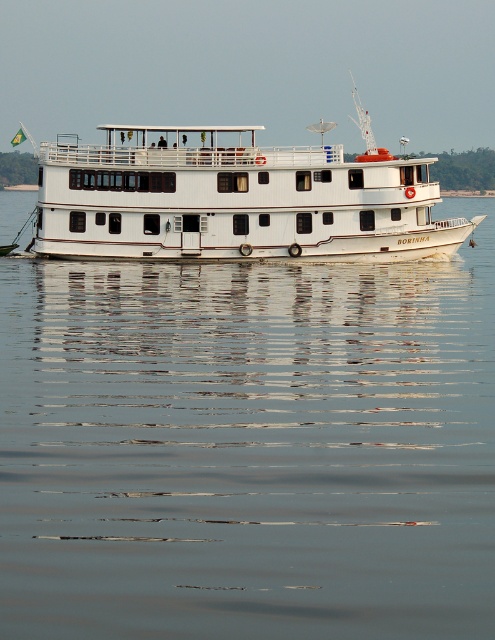
In the scene shown: You are standing on the upper deck of the DORINHA riverboat and looking down. Where would you see the smooth white water at center? Please provide the 2D coordinates in the format of a point like this example format point 0.700, 0.503.

The smooth white water at center is located at point (248, 448).

You are standing on the deck of the DORINHA riverboat and want to take a photo of the point at coordinates point (97, 328). If your camera has a maximum range of 25 meters, will you be able to capture the point in your photo?

The point (97, 328) is 25.52 meters away from the camera, which exceeds the camera maximum range of 25 meters. Therefore, you won not be able to capture the point in your photo.

You are planning to place a small floating dock on the water. The dock requires a space that is wider than the smooth white water at center. Can the white matte boat at center provide enough width for this dock?

The smooth white water at center has a width less than the white matte boat at center. Therefore, the white matte boat at center is wider, so it can provide enough width for the dock requiring a space wider than the smooth white water at center.